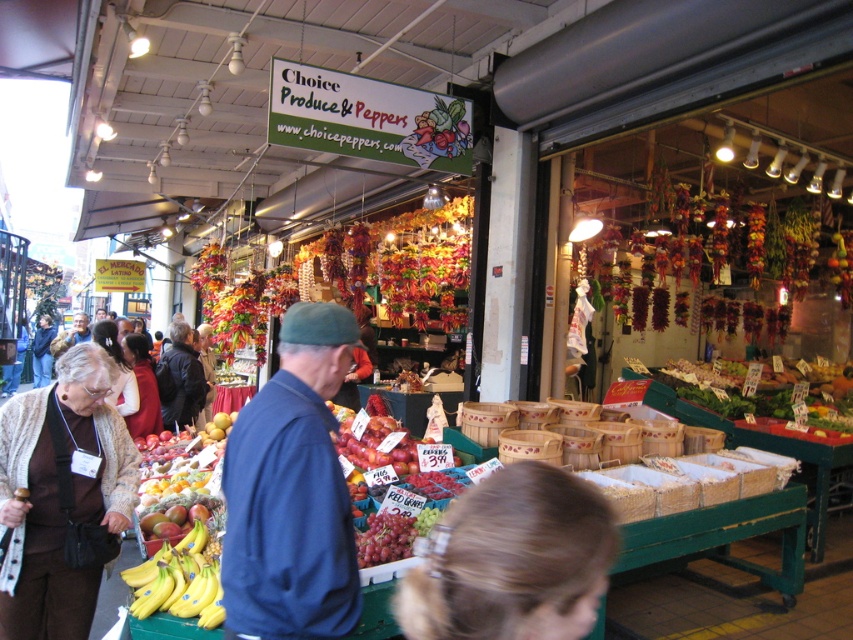
From the picture: You are a customer at the market and want to ask the vendor about the peppers. You see a person with blonde hair at lower center and another wearing a white fabric jacket at lower left. Which person should you approach to get information about the stall?

You should approach the blonde hair at lower center because they are positioned to the right of the white fabric jacket at lower left, likely being closer to the stall labeled

You are navigating through the market and want to reach a specific point. You are currently at point (41, 358). There is another point at (346, 554). Which point is closer to you?

Point (346, 554) is in front of point (41, 358), so the closer point to you is point (346, 554).